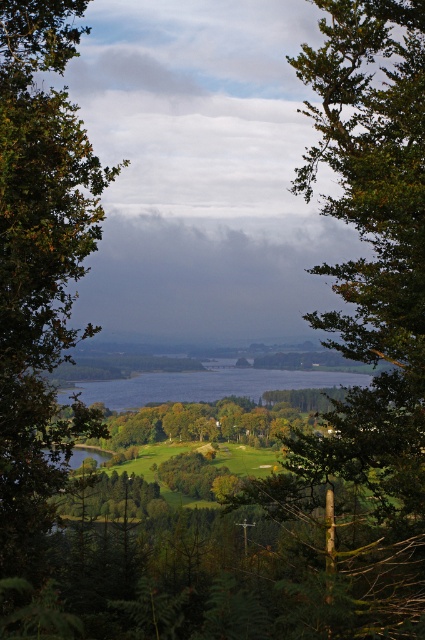
Can you confirm if green leafy tree at left is positioned below clear water at center?

Actually, green leafy tree at left is above clear water at center.

Who is shorter, green leafy tree at left or clear water at center?

With less height is clear water at center.

Locate an element on the screen. The height and width of the screenshot is (640, 425). green leafy tree at left is located at coordinates (39, 266).